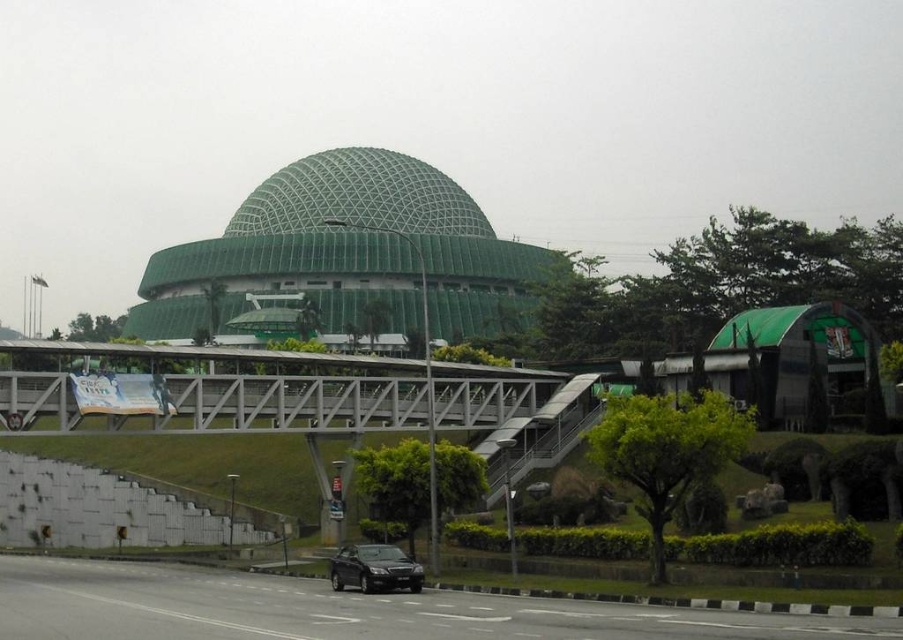
You are a pedestrian standing on the white concrete pedestrian bridge at center and want to cross to the road below. Can you see the matte black car at lower center from your current position?

The white concrete pedestrian bridge at center is positioned on the left side of the matte black car at lower center, so yes, you can see the matte black car at lower center from your position on the bridge.

You are standing at the point with coordinates point (177, 349) and want to walk towards the point with coordinates point (334, 212). Which direction should you move relative to the dome building?

To reach point (334, 212) from point (177, 349), you should move behind the dome building since point (177, 349) is in front of point (334, 212).

You are a delivery driver approaching the green mesh dome at center and the matte black car at lower center. You need to know which object is taller to plan your route. Can you determine which one is taller?

The green mesh dome at center is taller than the matte black car at lower center according to the description.